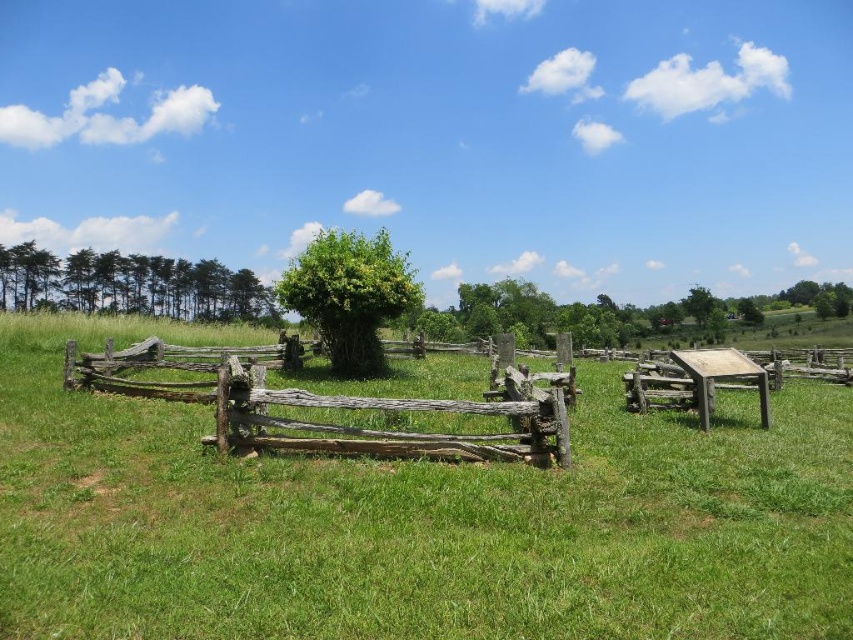
You are standing at the point labeled as point [131,285] in the image. Looking towards the direction of the green matte trees at left, which direction should you walk to reach the split rail fence?

The point [131,285] is located at the green matte trees at left. To reach the split rail fence, you should walk towards the right since the fence runs diagonally across the scene from left to right.

You are an environmental planner assessing a rural landscape. You need to determine which of the two trees, the green matte trees at left or the green leafy tree at center, would cast a larger shadow during midday. Based on their sizes, which one would have a larger shadow?

The green matte trees at left is bigger than the green leafy tree at center, so it would cast a larger shadow during midday.

You are a gardener planning to plant a new flower bed between the weathered wood fence at center and the green leafy tree at center. Based on their positions, which side of the tree should you place the flowers?

The weathered wood fence at center is positioned on the left side of the green leafy tree at center, so the flower bed should be placed on the left side of the green leafy tree at center between them.